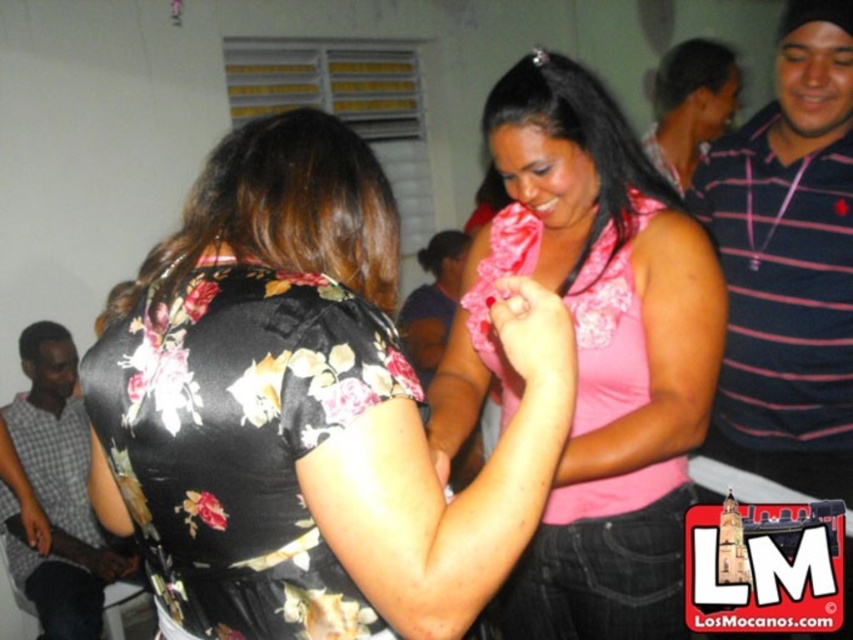
Image resolution: width=853 pixels, height=640 pixels. What do you see at coordinates (306, 410) in the screenshot? I see `floral satin blouse at center` at bounding box center [306, 410].

Which is in front, point (303, 220) or point (672, 120)?

Point (303, 220) is more forward.

The width and height of the screenshot is (853, 640). What are the coordinates of `floral satin blouse at center` in the screenshot? It's located at (306, 410).

Consider the image. Which is more to the left, pink satin blouse at center or pink satin blouse at upper center?

pink satin blouse at upper center is more to the left.

Can you confirm if pink satin blouse at center is positioned below pink satin blouse at upper center?

Yes.

Who is more forward, (543,204) or (448,237)?

Point (543,204) is in front.

Locate an element on the screen. pink satin blouse at center is located at coordinates (592, 353).

Is checkered fabric shirt at left shorter than pink satin blouse at upper center?

No.

Locate an element on the screen. Image resolution: width=853 pixels, height=640 pixels. checkered fabric shirt at left is located at coordinates (57, 493).

Is point (123, 564) more distant than point (430, 284)?

No.

At what (x,y) coordinates should I click in order to perform the action: click on checkered fabric shirt at left. Please return your answer as a coordinate pair (x, y). Looking at the image, I should click on (57, 493).